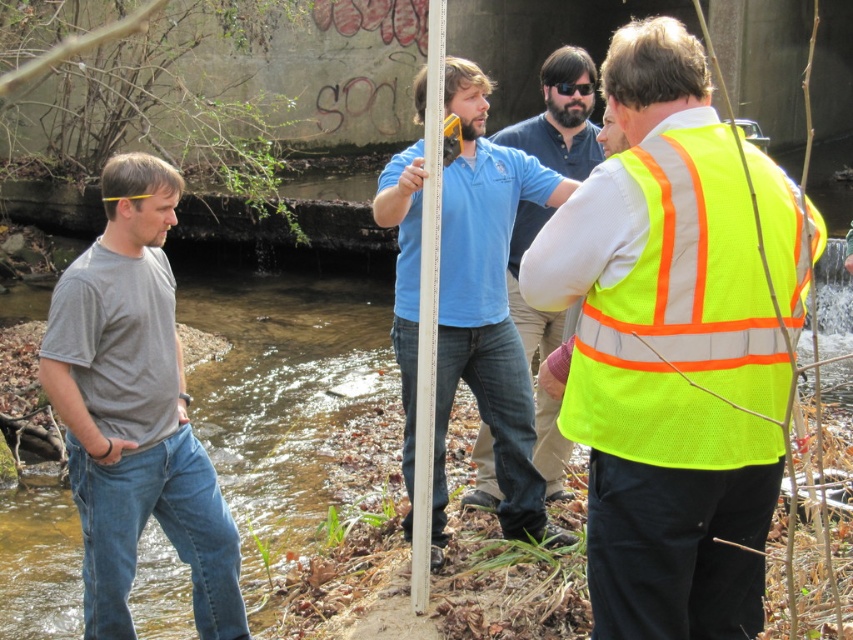
Is neon yellow mesh safety vest at right to the left of white plastic pole at center from the viewer's perspective?

No, neon yellow mesh safety vest at right is not to the left of white plastic pole at center.

Does point (712, 230) come closer to viewer compared to point (430, 134)?

Yes, point (712, 230) is closer to viewer.

Locate an element on the screen. This screenshot has height=640, width=853. neon yellow mesh safety vest at right is located at coordinates (682, 321).

Where is `neon yellow mesh safety vest at right`? neon yellow mesh safety vest at right is located at coordinates (682, 321).

Does point (752, 454) come farther from viewer compared to point (140, 449)?

No, it is in front of (140, 449).

Which is behind, point (662, 339) or point (141, 436)?

The point (141, 436) is more distant.

This screenshot has height=640, width=853. Identify the location of neon yellow mesh safety vest at right. click(x=682, y=321).

Between gray cotton t-shirt at left and neon yellow safety vest at center, which one is positioned lower?

neon yellow safety vest at center is below.

Is gray cotton t-shirt at left in front of neon yellow safety vest at center?

Yes, gray cotton t-shirt at left is in front of neon yellow safety vest at center.

Who is more forward, (83, 460) or (494, 484)?

Point (83, 460) is more forward.

This screenshot has width=853, height=640. What are the coordinates of `gray cotton t-shirt at left` in the screenshot? It's located at (134, 410).